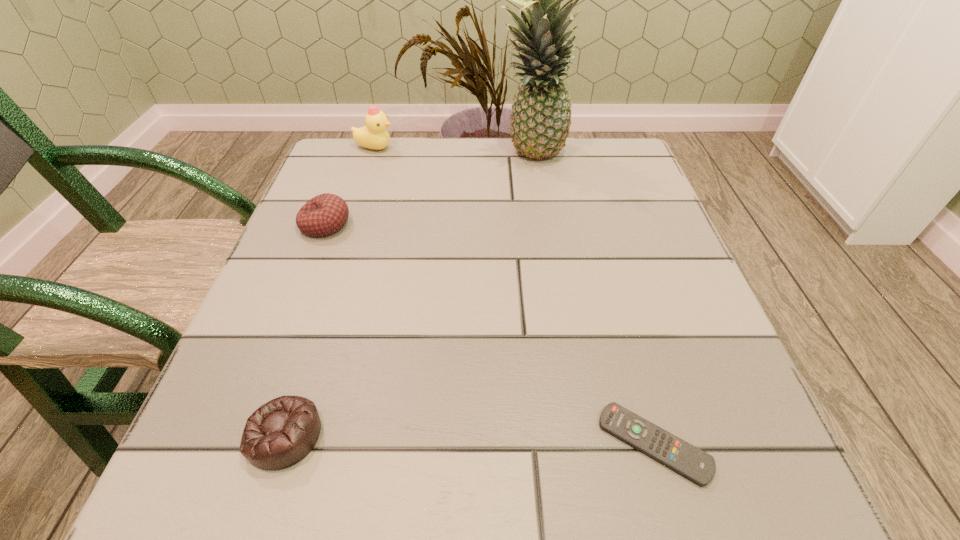
This screenshot has height=540, width=960. What are the coordinates of `vacant area located 0.210m on the right of the shorter beanbag` in the screenshot? It's located at (478, 435).

Locate an element on the screen. This screenshot has height=540, width=960. vacant area situated on the left of the remote control is located at coordinates 413,444.

Where is `pineapple positioned at the far edge`? This screenshot has height=540, width=960. pineapple positioned at the far edge is located at coordinates (541, 115).

What are the coordinates of `duckling that is at the far edge` in the screenshot? It's located at (374, 135).

This screenshot has height=540, width=960. Find the location of `beanbag that is at the near edge`. beanbag that is at the near edge is located at coordinates (279, 434).

What are the coordinates of `remote control that is at the near edge` in the screenshot? It's located at (699, 467).

Find the location of a particular element. This screenshot has width=960, height=540. duckling that is at the left edge is located at coordinates (374, 135).

This screenshot has height=540, width=960. In order to click on object positioned at the right edge in this screenshot , I will do 699,467.

Where is `object positioned at the far left corner`? The height and width of the screenshot is (540, 960). object positioned at the far left corner is located at coordinates (374, 135).

I want to click on object present at the near left corner, so click(x=279, y=434).